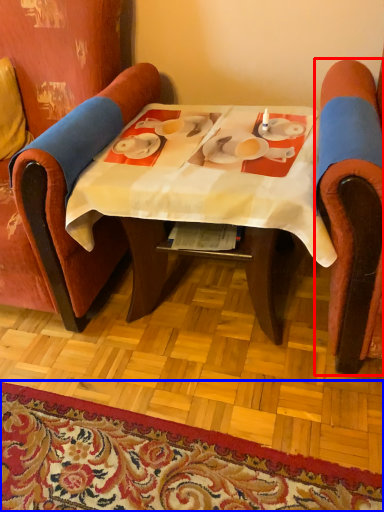
Question: Among these objects, which one is farthest to the camera, chair (highlighted by a red box) or mat (highlighted by a blue box)?

Choices:
 (A) chair
 (B) mat

Answer: (B)